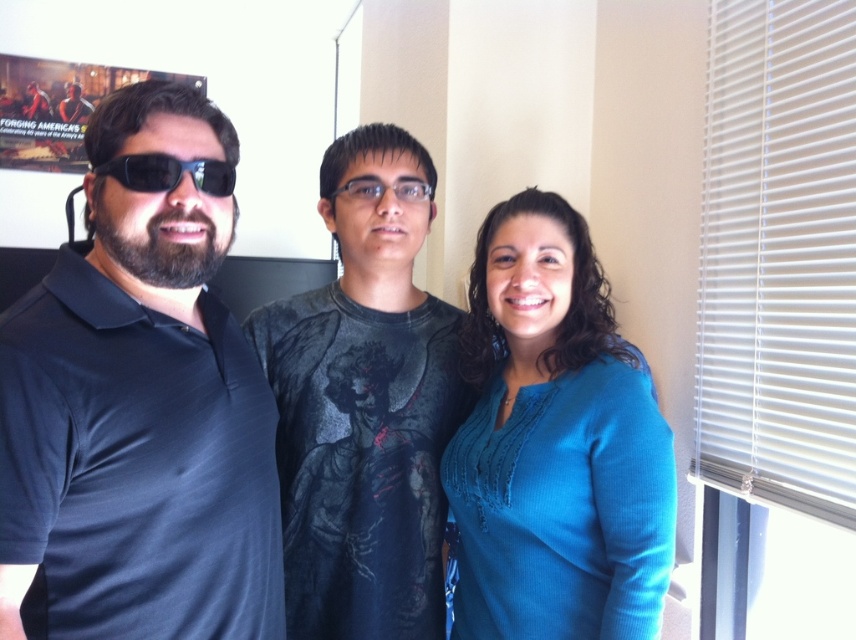
You are trying to decide which item to take for a casual day out. Both the blue knit sweater at center and the matte black polo shirt at left are available. Based on their sizes, which one might be more suitable if you prefer a looser, more comfortable fit?

The blue knit sweater at center has a larger size compared to the matte black polo shirt at left, so it would be more suitable for a looser, comfortable fit.

You are a photographer trying to focus on the dark gray printed shirt at center and the matte black goggles at left. Which object should you adjust your camera focus on first if you want to ensure both are in focus?

The dark gray printed shirt at center is positioned under matte black goggles at left, so you should focus on the matte black goggles at left first to ensure both are in focus.

You are standing in front of the group photo and want to determine which of the two points, point (395, 314) or point (200, 182), is closer to you. Based on the scene description, which point is nearer?

Point (395, 314) is further to the viewer than point (200, 182), so the point closer to you is point (200, 182).